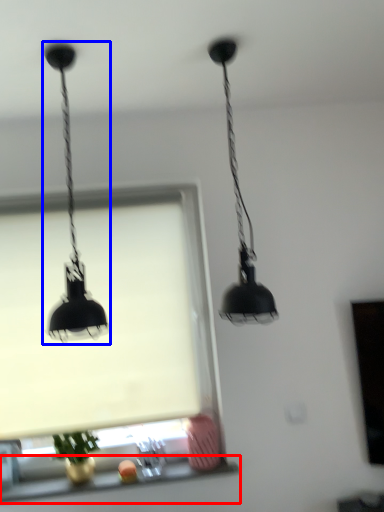
Question: Which object is further to the camera taking this photo, window sill (highlighted by a red box) or lamp (highlighted by a blue box)?

Choices:
 (A) window sill
 (B) lamp

Answer: (A)